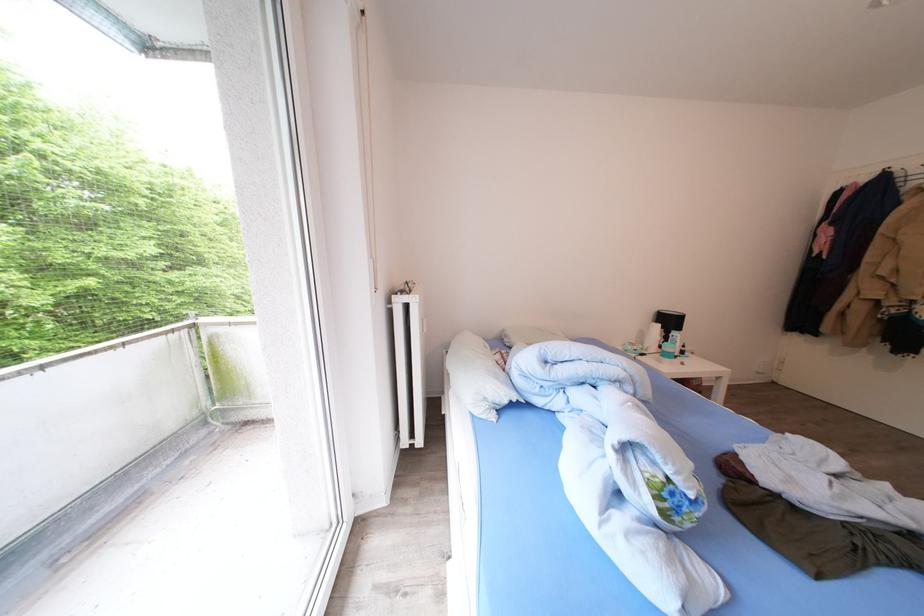
You are a GUI agent. You are given a task and a screenshot of the screen. Output one action in this format:
    pyautogui.click(x=<x>, y=<y>)
    Task: Click on the black coffee maker
    
    Given the screenshot: What is the action you would take?
    pyautogui.click(x=669, y=322)